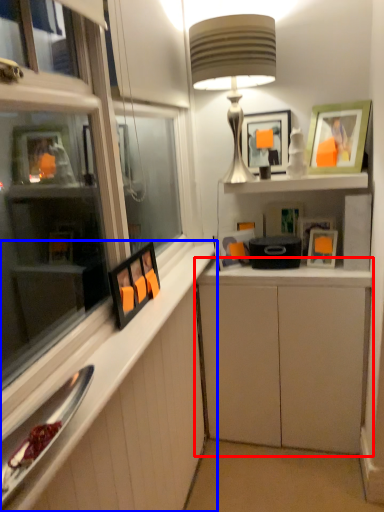
Question: Among these objects, which one is nearest to the camera, cabinetry (highlighted by a red box) or cabinetry (highlighted by a blue box)?

Choices:
 (A) cabinetry
 (B) cabinetry

Answer: (B)